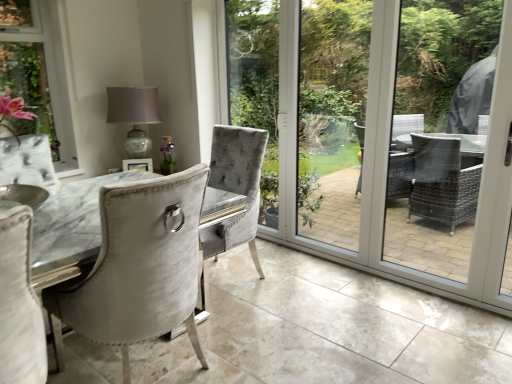
Find the location of a particular element. The width and height of the screenshot is (512, 384). free point below satin white chair at center (from a real-world perspective) is located at coordinates (138, 364).